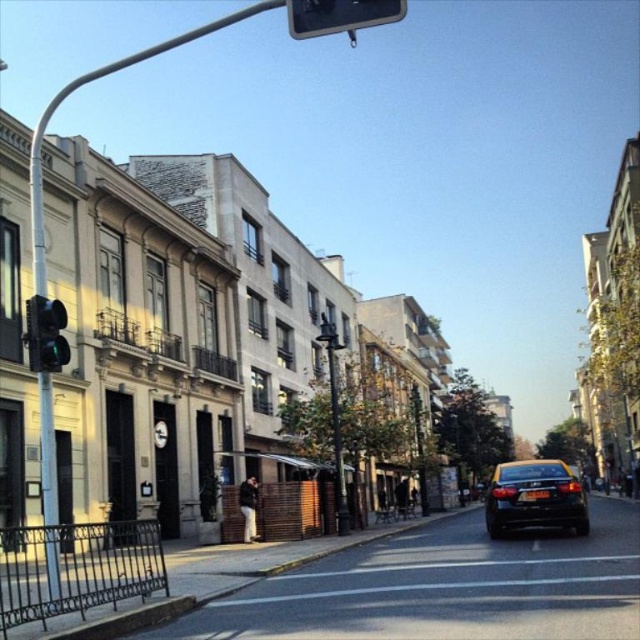
You are a pedestrian standing on the sidewalk and want to cross the street to reach a store located behind the black glossy car at center. The metallic rectangular sign at upper center indicates traffic rules. According to the sign, when is it safe to cross?

The black glossy car at center is below the metallic rectangular sign at upper center, so the sign is positioned above the car. Since the sign is likely a traffic light or stop sign, you should wait until the light turns green or follow the sign instructions before crossing safely.

You are a delivery person who needs to park your delivery van, which is 2 meters tall, in this street. You see the black glossy car at center and the metallic rectangular sign at upper center. Which object is taller, and will your van fit under the sign?

The metallic rectangular sign at upper center is taller than the black glossy car at center. Since the van is 2 meters tall, and the sign is taller than the car but the exact height isn t specified, it s possible the van might fit, but there s uncertainty without precise measurements.

You are standing at the intersection and see the metallic rectangular sign at upper center located at point (340, 16). Is the sign facing towards the street or away from it?

The metallic rectangular sign at upper center located at point (340, 16) is facing towards the street as it is positioned at the upper center, which is a common placement for signs meant to be visible to those on the street.